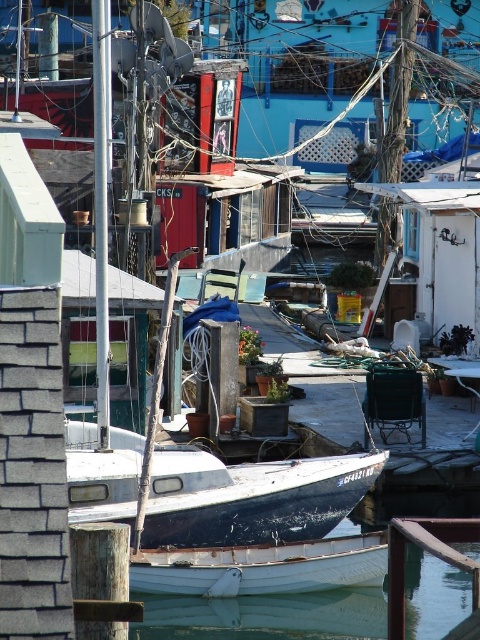
You are standing on the dock and looking at the white boat with a dark hull. There is a point marked at coordinates (266, 616). What is located at that point?

The point at coordinates (266, 616) indicates white smooth water at lower center.